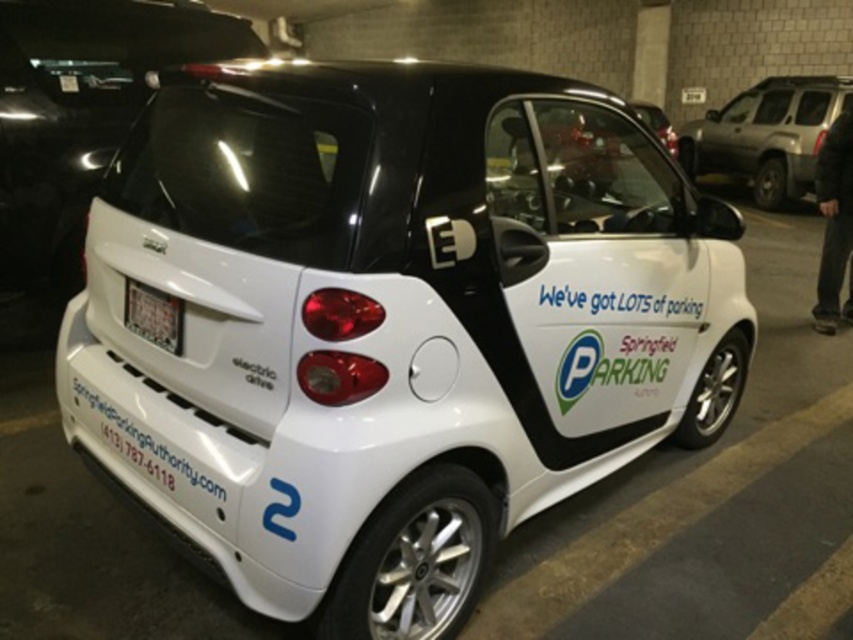
You are a parking attendant in a multi level parking garage. You need to guide a driver to park their car between the two points marked on the map. The points are point (x=747, y=173) and point (x=146, y=308). Which point should the driver approach first to ensure they are parked between them?

The driver should approach point (x=146, y=308) first because point (x=747, y=173) is behind it, so parking between them would require starting from the front point.

You are a delivery person trying to park your van in the parking garage. You see a matte black suv at upper right and a white plastic license plate at rear. Which object is blocking your path to the parking spot?

The matte black suv at upper right is blocking your path to the parking spot because it is positioned over the white plastic license plate at rear, which likely marks the parking spot.